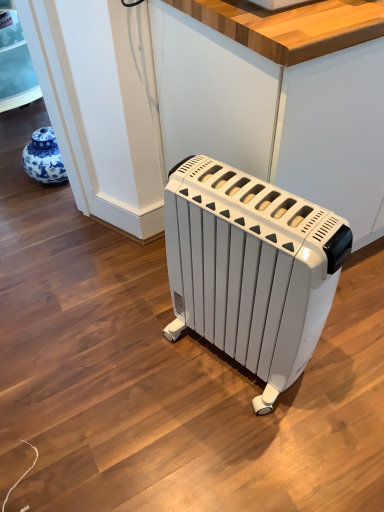
The height and width of the screenshot is (512, 384). Identify the location of free spot above white plastic radiator at center (from a real-world perspective). (253, 199).